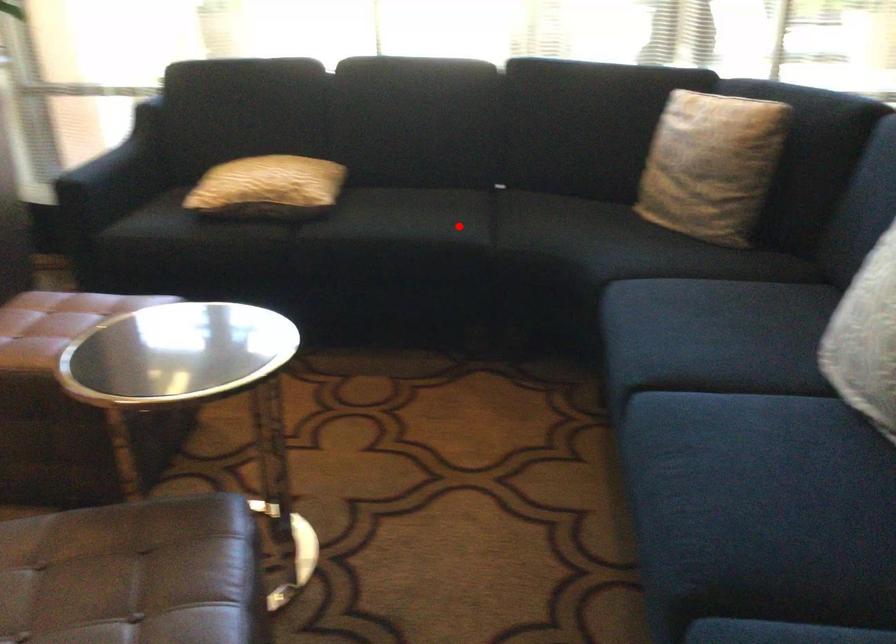
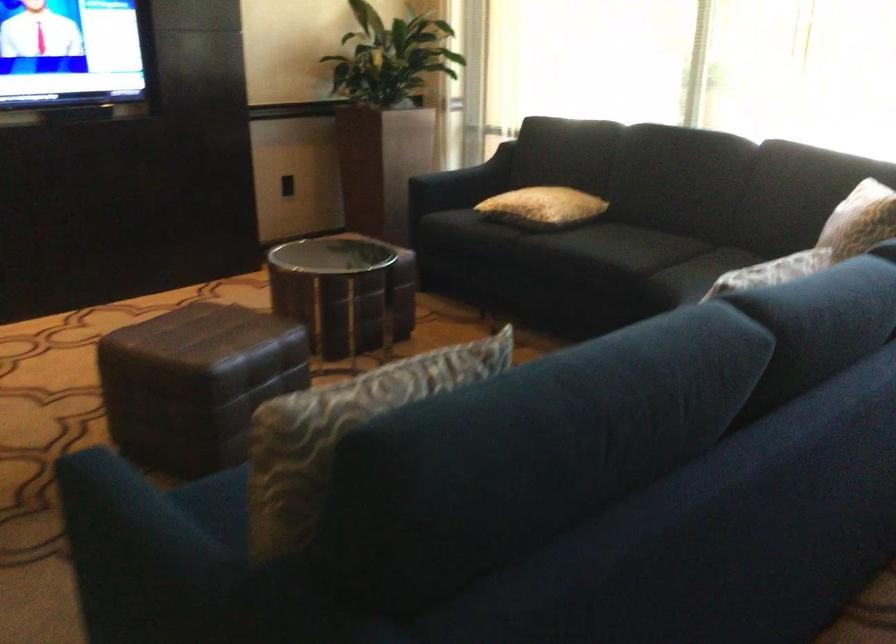
Question: A red point is marked in image1. In image2, is the corresponding 3D point closer to the camera or farther? Reply with the corresponding letter.

Choices:
 (A) The corresponding 3D point is closer.
 (B) The corresponding 3D point is farther.

Answer: (B)